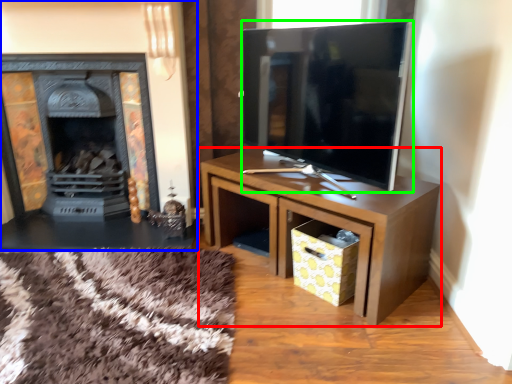
Question: Based on their relative distances, which object is farther from table (highlighted by a red box)? Choose from fireplace (highlighted by a blue box) and television (highlighted by a green box).

Choices:
 (A) fireplace
 (B) television

Answer: (A)